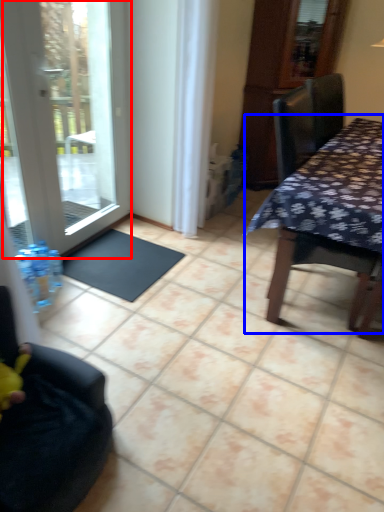
Question: Which object is further to the camera taking this photo, door (highlighted by a red box) or table (highlighted by a blue box)?

Choices:
 (A) door
 (B) table

Answer: (A)